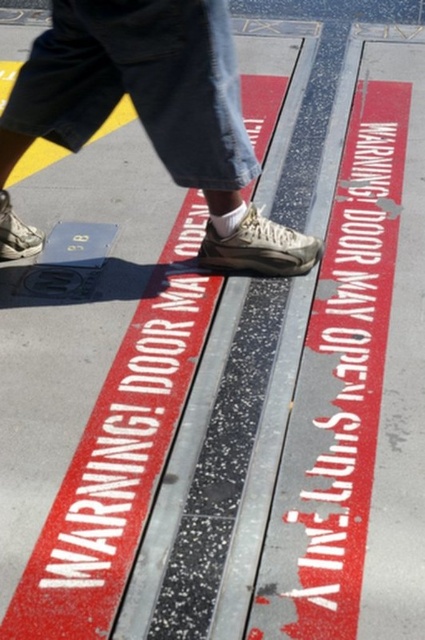
Question: Among these points, which one is nearest to the camera?

Choices:
 (A) (11, 122)
 (B) (359, 580)

Answer: (B)

Question: Does matte gray sneakers at center appear over white painted text at center?

Choices:
 (A) no
 (B) yes

Answer: (B)

Question: Is matte gray sneakers at center above white painted text at center?

Choices:
 (A) yes
 (B) no

Answer: (A)

Question: Is matte gray sneakers at center bigger than white painted text at center?

Choices:
 (A) no
 (B) yes

Answer: (A)